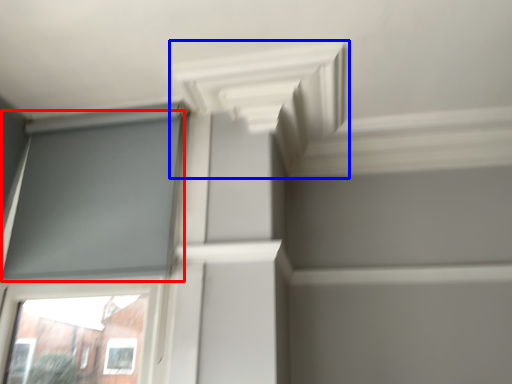
Question: Which object is further to the camera taking this photo, window screen (highlighted by a red box) or exhaust hood (highlighted by a blue box)?

Choices:
 (A) window screen
 (B) exhaust hood

Answer: (A)